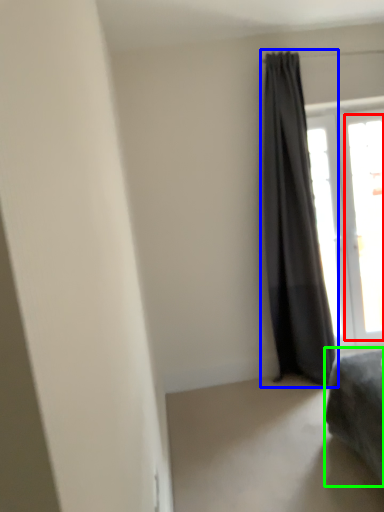
Question: Estimate the real-world distances between objects in this image. Which object is closer to window (highlighted by a red box), curtain (highlighted by a blue box) or furniture (highlighted by a green box)?

Choices:
 (A) curtain
 (B) furniture

Answer: (A)